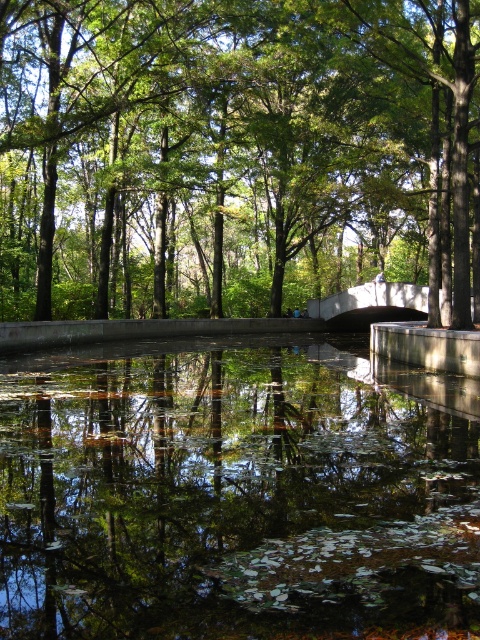
You are standing on the path near the pond and want to take a photo of the green leafy tree at center and its reflection in the transparent water at center. Which object is positioned higher in the scene?

The green leafy tree at center is above transparent water at center, so the tree is higher than the water.

You are standing at the edge of the pond and want to take a photo of the green leafy tree at center and the transparent water at center. Which object will appear bigger in your photo?

The green leafy tree at center will appear bigger in the photo because it is larger in size than the transparent water at center.

You are standing at the edge of the pond and see the green leafy tree at center and the transparent water at center. Which object is located to the right of the other?

The transparent water at center is to the right of the green leafy tree at center because the green leafy tree at center is positioned on the left side of transparent water at center.